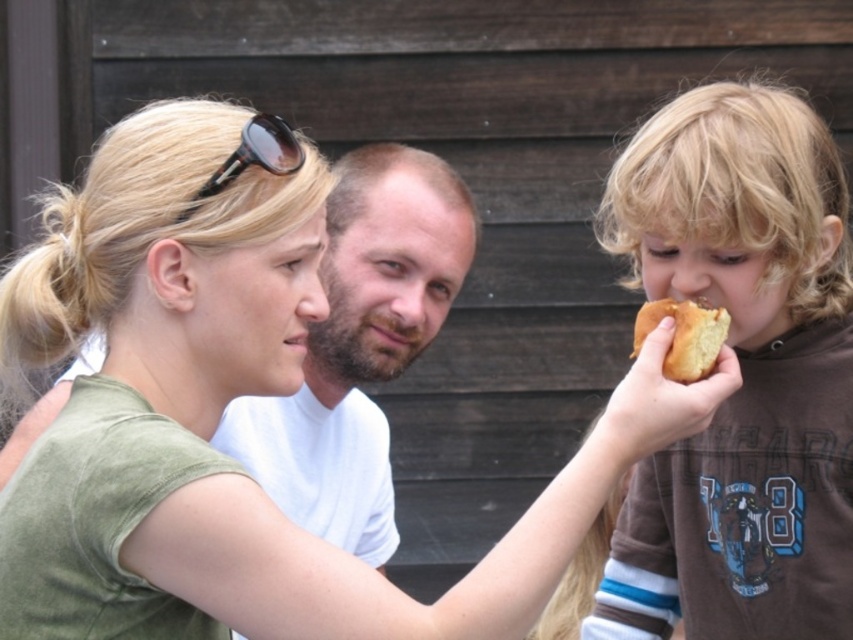
What is the color of the shirt at the point with coordinates (222, 412)?

The point at coordinates (222, 412) is on a matte green shirt at center, so the color is green.

Based on the scene description, where is the matte green shirt at center located in terms of its 2D coordinates?

The matte green shirt at center is located at the 2D coordinates point (222, 412).

You are at a picnic and want to grab the brown soft bread at right without moving the golden bread at right. Is it possible to do so?

The brown soft bread at right is positioned under golden bread at right, so you can reach it without moving the golden bread at right.